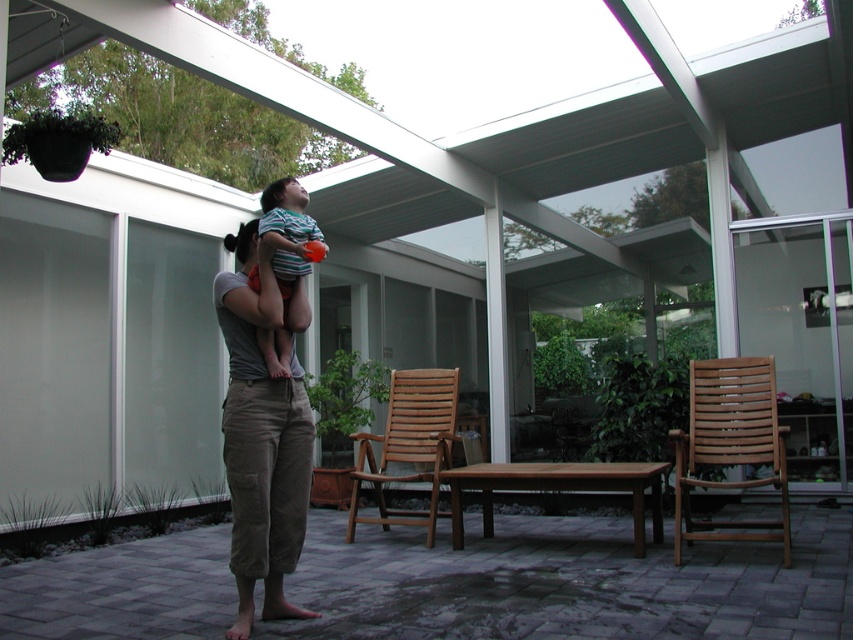
This screenshot has width=853, height=640. What are the coordinates of `khaki cotton pants at center` in the screenshot? It's located at (x=262, y=435).

Does khaki cotton pants at center appear on the right side of striped cotton shirt at center?

In fact, khaki cotton pants at center is to the left of striped cotton shirt at center.

Which is behind, point (253, 401) or point (299, 253)?

Positioned behind is point (253, 401).

Locate an element on the screen. This screenshot has width=853, height=640. khaki cotton pants at center is located at coordinates (262, 435).